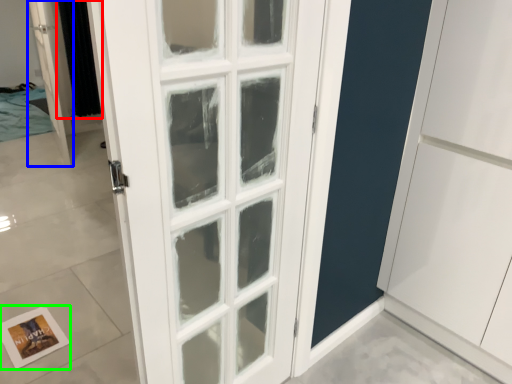
Question: Which object is positioned farthest from curtain (highlighted by a red box)? Select from door (highlighted by a blue box) and postcard (highlighted by a green box).

Choices:
 (A) door
 (B) postcard

Answer: (B)